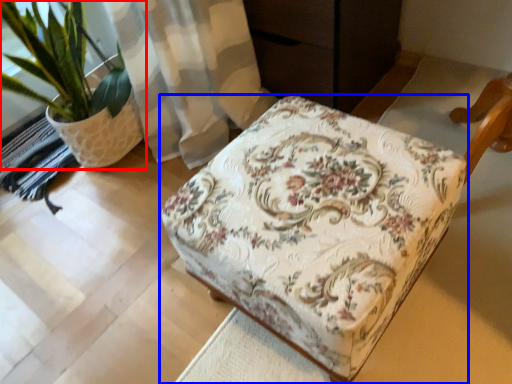
Question: Which point is further to the camera, houseplant (highlighted by a red box) or furniture (highlighted by a blue box)?

Choices:
 (A) houseplant
 (B) furniture

Answer: (A)